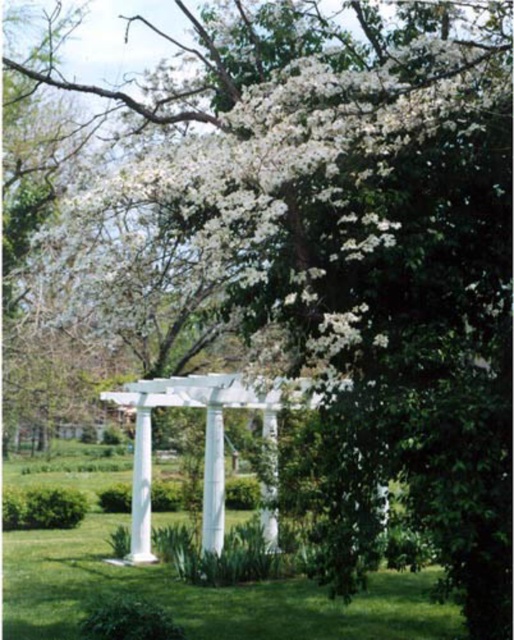
Question: Considering the real-world distances, which object is farthest from the white glossy column at center?

Choices:
 (A) white glossy pillar at center
 (B) green grass at lower center
 (C) white smooth pillar at center
 (D) white painted wood pergola at center

Answer: (B)

Question: Does green grass at lower center have a larger size compared to white smooth pillar at center?

Choices:
 (A) no
 (B) yes

Answer: (B)

Question: Among these objects, which one is farthest from the camera?

Choices:
 (A) white painted wood pergola at center
 (B) white glossy pillar at center

Answer: (A)

Question: Does white glossy column at center come behind white smooth pillar at center?

Choices:
 (A) yes
 (B) no

Answer: (A)

Question: Where is green grass at lower center located in relation to white painted wood pergola at center in the image?

Choices:
 (A) right
 (B) left

Answer: (B)

Question: Which of the following is the closest to the observer?

Choices:
 (A) [265, 412]
 (B) [214, 410]
 (C) [142, 445]

Answer: (B)